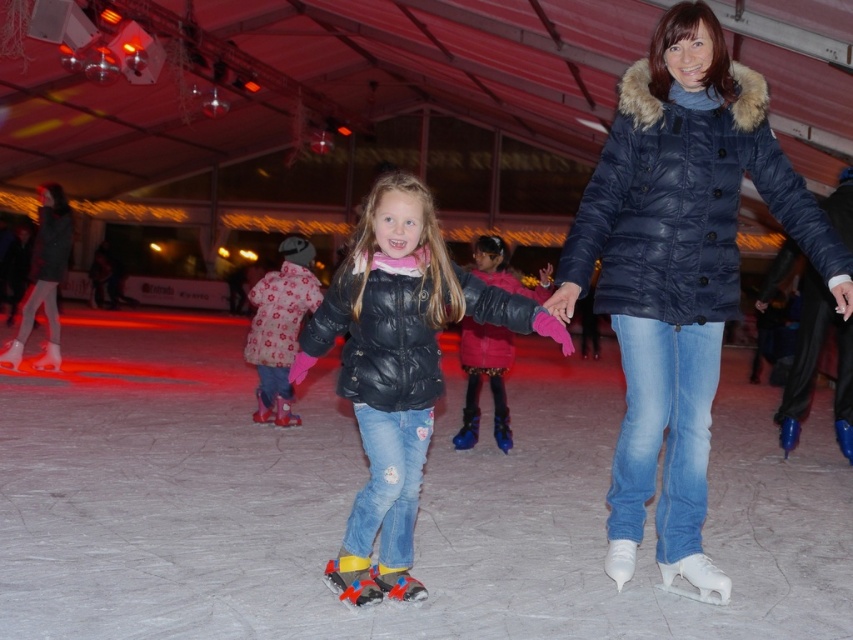
Question: Based on their relative distances, which object is nearer to the navy blue puffer jacket at center?

Choices:
 (A) velvet pink jacket at center
 (B) white smooth ice at center
 (C) fluffy pink snowsuit at center

Answer: (A)

Question: Which point is farther from the camera taking this photo?

Choices:
 (A) (143, 580)
 (B) (485, 273)

Answer: (B)

Question: Which point is farther to the camera?

Choices:
 (A) (367, 544)
 (B) (291, 289)
 (C) (512, 292)
 (D) (447, 550)

Answer: (B)

Question: In this image, where is matte black jacket at center located relative to fluffy pink snowsuit at center?

Choices:
 (A) right
 (B) left

Answer: (A)

Question: Is matte black jacket at center to the right of velvet pink jacket at center from the viewer's perspective?

Choices:
 (A) yes
 (B) no

Answer: (B)

Question: Is white smooth ice at center to the left of matte black jacket at center from the viewer's perspective?

Choices:
 (A) no
 (B) yes

Answer: (B)